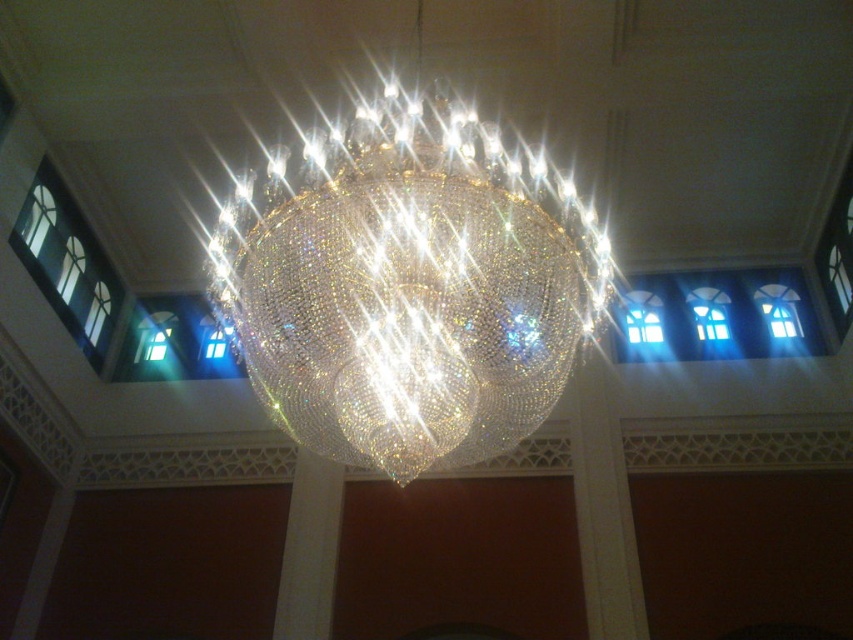
Question: Does blue glass window at upper center have a larger size compared to clear glass window at left?

Choices:
 (A) no
 (B) yes

Answer: (B)

Question: Which is farther from the clear glass window at left?

Choices:
 (A) blue glass window at upper center
 (B) crystal glass chandelier at center

Answer: (A)

Question: Based on their relative distances, which object is farther from the clear glass window at left?

Choices:
 (A) crystal glass chandelier at center
 (B) blue glass window at upper center

Answer: (B)

Question: Is the position of blue glass window at upper center less distant than that of clear glass window at left?

Choices:
 (A) no
 (B) yes

Answer: (A)

Question: Does crystal glass chandelier at center have a lesser width compared to blue glass window at upper center?

Choices:
 (A) no
 (B) yes

Answer: (B)

Question: Which object is farther from the camera taking this photo?

Choices:
 (A) blue glass window at upper center
 (B) clear glass window at left

Answer: (A)